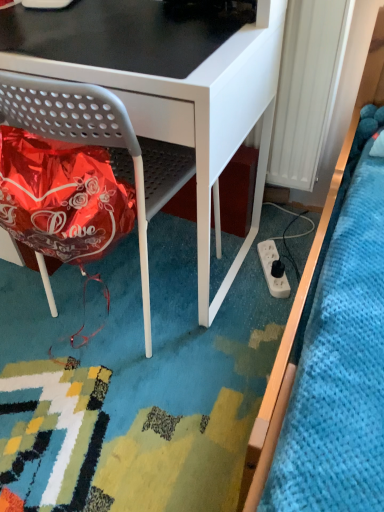
Find the location of a particular element. unoccupied space behind white plastic power plugs and sockets at lower right is located at coordinates (266, 238).